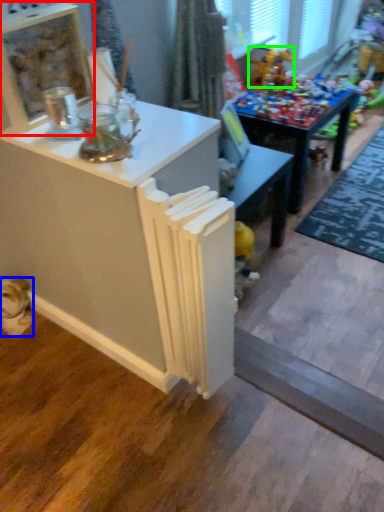
Question: Which is farther away from shelf (highlighted by a red box)? animal (highlighted by a blue box) or toy (highlighted by a green box)?

Choices:
 (A) animal
 (B) toy

Answer: (B)